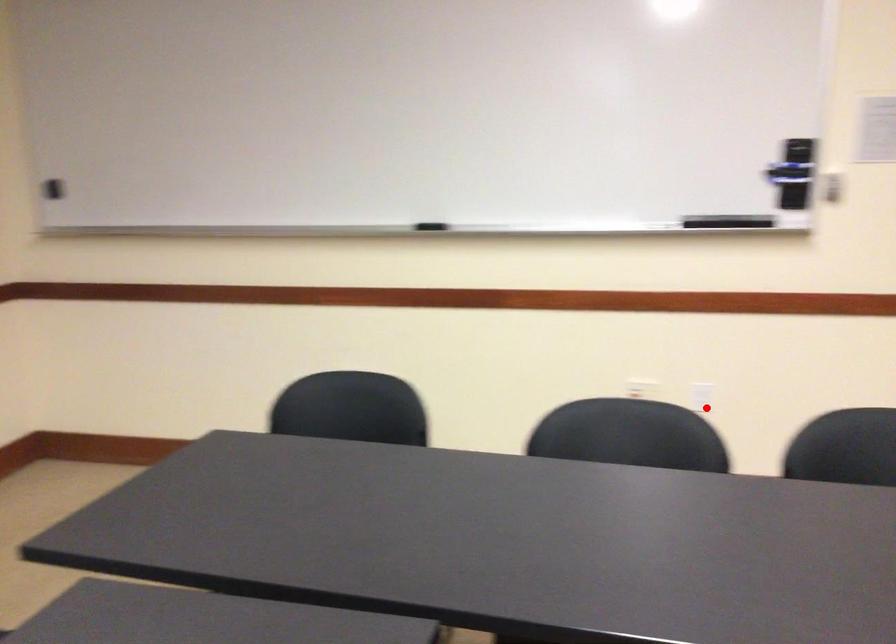
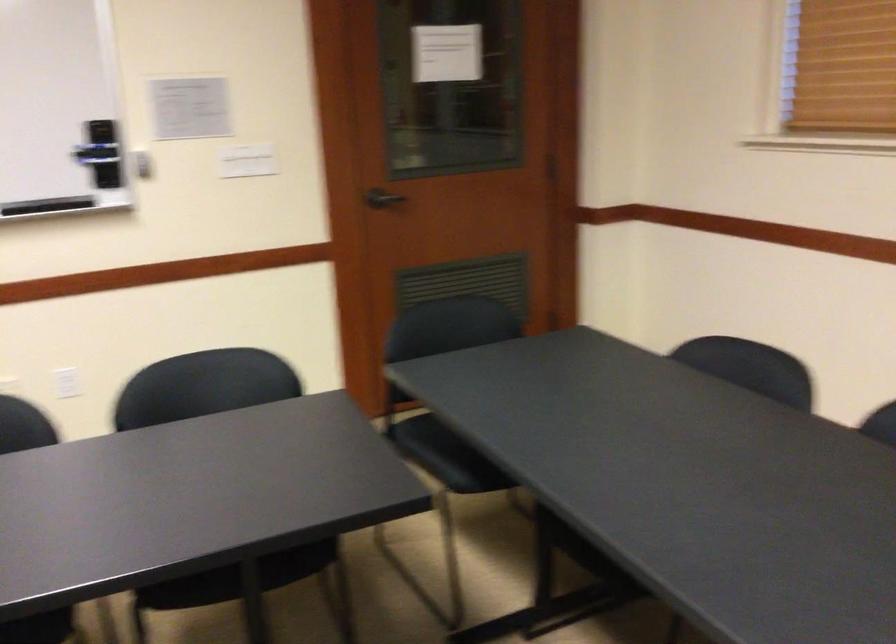
In the second image, find the point that corresponds to the highlighted location in the first image.

(66, 383)